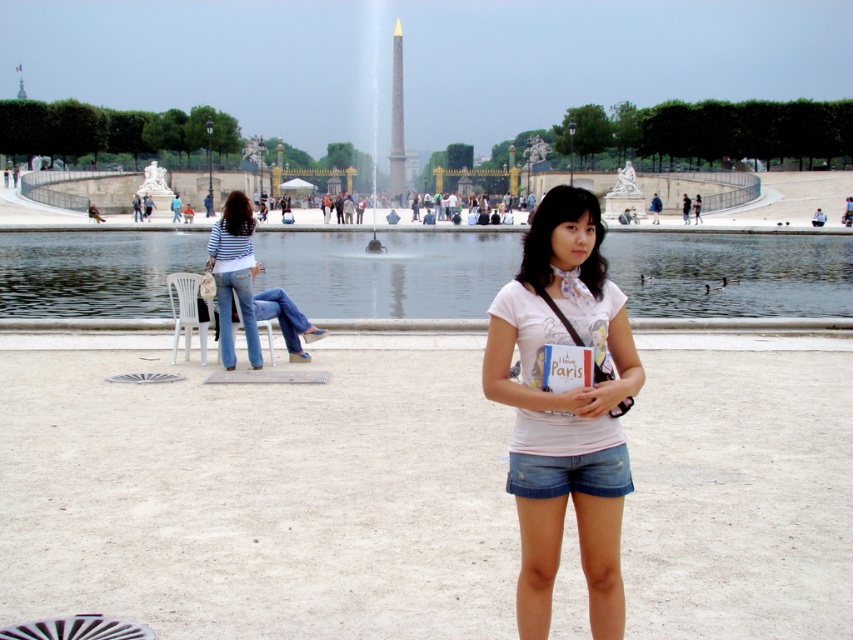
Is point (614, 348) behind point (221, 243)?

No, it is in front of (221, 243).

Does point (517, 296) come closer to viewer compared to point (248, 352)?

Yes, point (517, 296) is closer to viewer.

Locate an element on the screen. white cotton shirt at center is located at coordinates (566, 406).

Does point (341, 280) lie in front of point (630, 476)?

No, it is behind (630, 476).

Can you confirm if clear water at center is bigger than denim shorts at lower center?

Correct, clear water at center is larger in size than denim shorts at lower center.

Is point (518, 244) farther from viewer compared to point (614, 476)?

Yes, it is behind point (614, 476).

Where is `clear water at center`? This screenshot has width=853, height=640. clear water at center is located at coordinates (387, 273).

Does clear water at center have a lesser height compared to striped fabric shirt at center?

No.

Does clear water at center appear over striped fabric shirt at center?

Indeed, clear water at center is positioned over striped fabric shirt at center.

Does point (273, 244) lie in front of point (241, 243)?

No, it is not.

In order to click on clear water at center in this screenshot , I will do `click(387, 273)`.